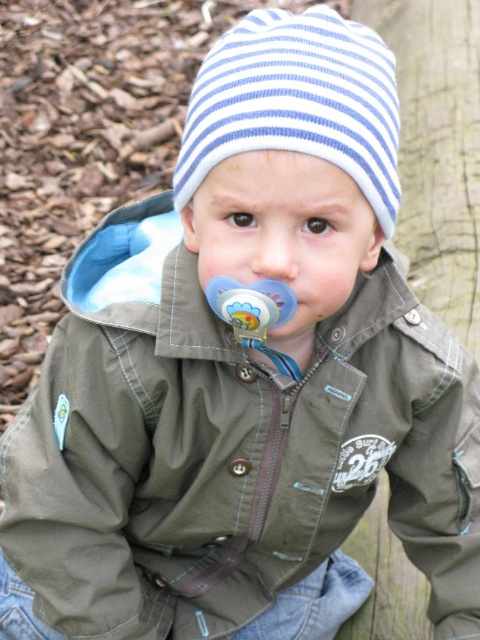
The child is holding a blue rubber pacifier at center and has a smooth skin nose at center. How far apart are these two items?

The blue rubber pacifier at center and smooth skin nose at center are 6.13 centimeters apart.

The child is wearing a blue striped knit hat at upper center and has a blue rubber pacifier at center. Which item is covering the other?

The blue striped knit hat at upper center is positioned over the blue rubber pacifier at center, so the hat is covering the pacifier.

You are standing 26.81 inches away from the point marked at coordinates (224, 145). If you want to reach into your pocket to grab a small toy, will you be able to do so without moving closer to the point?

The point marked at coordinates (224, 145) is 26.81 inches away from you. Since reaching into your pocket typically requires about 18 inches of arm length, you would need to move closer to comfortably reach the point without straining.